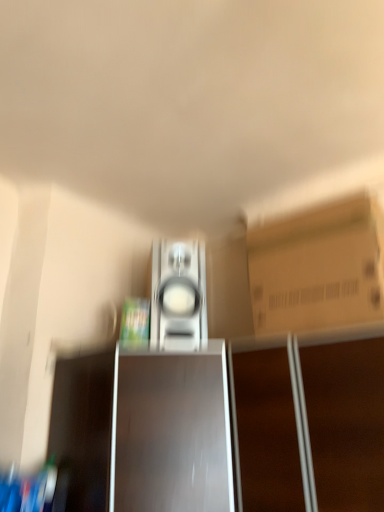
You are a GUI agent. You are given a task and a screenshot of the screen. Output one action in this format:
    pyautogui.click(x=<x>, y=<y>)
    Task: Click on the shiny brown cabinet at center
    This screenshot has width=384, height=512.
    Given the screenshot: What is the action you would take?
    pyautogui.click(x=171, y=431)

The height and width of the screenshot is (512, 384). What do you see at coordinates (178, 294) in the screenshot?
I see `satin silver speaker at center` at bounding box center [178, 294].

Where is `shiny brown cabinet at center`? Image resolution: width=384 pixels, height=512 pixels. shiny brown cabinet at center is located at coordinates (171, 431).

Would you say brown cardboard box at upper right is inside or outside shiny brown cabinet at center?

brown cardboard box at upper right lies outside shiny brown cabinet at center.

Which is behind, point (284, 326) or point (213, 418)?

Point (284, 326)

Is brown cardboard box at upper right facing away from shiny brown cabinet at center?

No, brown cardboard box at upper right is not facing the opposite direction of shiny brown cabinet at center.

Which of these two, shiny brown cabinet at center or satin silver speaker at center, stands taller?

shiny brown cabinet at center.

From the image's perspective, which is above, shiny brown cabinet at center or satin silver speaker at center?

From the image's view, satin silver speaker at center is above.

Is shiny brown cabinet at center oriented towards satin silver speaker at center?

No, shiny brown cabinet at center is not turned towards satin silver speaker at center.

From the image's perspective, which object appears higher, brown cardboard box at upper right or satin silver speaker at center?

brown cardboard box at upper right is shown above in the image.

Is brown cardboard box at upper right aimed at satin silver speaker at center?

No, brown cardboard box at upper right is not aimed at satin silver speaker at center.

Is brown cardboard box at upper right to the right of satin silver speaker at center from the viewer's perspective?

Indeed, brown cardboard box at upper right is positioned on the right side of satin silver speaker at center.

Does brown cardboard box at upper right have a greater width compared to satin silver speaker at center?

Indeed, brown cardboard box at upper right has a greater width compared to satin silver speaker at center.

Is point (201, 243) more distant than point (161, 421)?

Yes, point (201, 243) is behind point (161, 421).

Based on the photo, in terms of height, does satin silver speaker at center look taller or shorter compared to shiny brown cabinet at center?

satin silver speaker at center is shorter than shiny brown cabinet at center.

Which of these two, satin silver speaker at center or shiny brown cabinet at center, is smaller?

Smaller between the two is satin silver speaker at center.

This screenshot has width=384, height=512. I want to click on cardboard box above the satin silver speaker at center (from the image's perspective), so click(318, 267).

Which object is wider, satin silver speaker at center or brown cardboard box at upper right?

brown cardboard box at upper right is wider.

Is point (158, 308) positioned before point (360, 263)?

No.

From the picture: From their relative heights in the image, would you say satin silver speaker at center is taller or shorter than brown cardboard box at upper right?

In the image, satin silver speaker at center appears to be shorter than brown cardboard box at upper right.

Which of these two, shiny brown cabinet at center or brown cardboard box at upper right, stands shorter?

Standing shorter between the two is brown cardboard box at upper right.

Is shiny brown cabinet at center wider than brown cardboard box at upper right?

Yes.

Is shiny brown cabinet at center positioned with its back to brown cardboard box at upper right?

That's not correct — shiny brown cabinet at center is not looking away from brown cardboard box at upper right.

How much distance is there between shiny brown cabinet at center and brown cardboard box at upper right?

37.14 centimeters.

At what (x,y) coordinates should I click in order to perform the action: click on cardboard box above the shiny brown cabinet at center (from the image's perspective). Please return your answer as a coordinate pair (x, y). This screenshot has width=384, height=512. Looking at the image, I should click on (318, 267).

This screenshot has width=384, height=512. Find the location of `home appliance above the shiny brown cabinet at center (from a real-world perspective)`. home appliance above the shiny brown cabinet at center (from a real-world perspective) is located at coordinates (178, 294).

Which object lies further to the anchor point brown cardboard box at upper right, shiny brown cabinet at center or satin silver speaker at center?

satin silver speaker at center lies further to brown cardboard box at upper right than the other object.

Looking at the image, which one is located further to shiny brown cabinet at center, brown cardboard box at upper right or satin silver speaker at center?

brown cardboard box at upper right lies further to shiny brown cabinet at center than the other object.

Looking at the image, which one is located closer to satin silver speaker at center, shiny brown cabinet at center or brown cardboard box at upper right?

shiny brown cabinet at center is closer to satin silver speaker at center.

Based on their spatial positions, is satin silver speaker at center or brown cardboard box at upper right further from shiny brown cabinet at center?

brown cardboard box at upper right.

From the image, which object appears to be farther from satin silver speaker at center, brown cardboard box at upper right or shiny brown cabinet at center?

brown cardboard box at upper right lies further to satin silver speaker at center than the other object.

From the image, which object appears to be nearer to brown cardboard box at upper right, satin silver speaker at center or shiny brown cabinet at center?

shiny brown cabinet at center lies closer to brown cardboard box at upper right than the other object.

This screenshot has width=384, height=512. What are the coordinates of `home appliance between brown cardboard box at upper right and shiny brown cabinet at center in the up-down direction` in the screenshot? It's located at (178, 294).